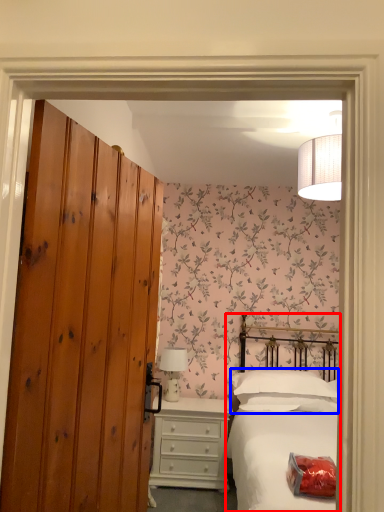
Question: Which object appears farthest to the camera in this image, bed (highlighted by a red box) or pillow (highlighted by a blue box)?

Choices:
 (A) bed
 (B) pillow

Answer: (B)